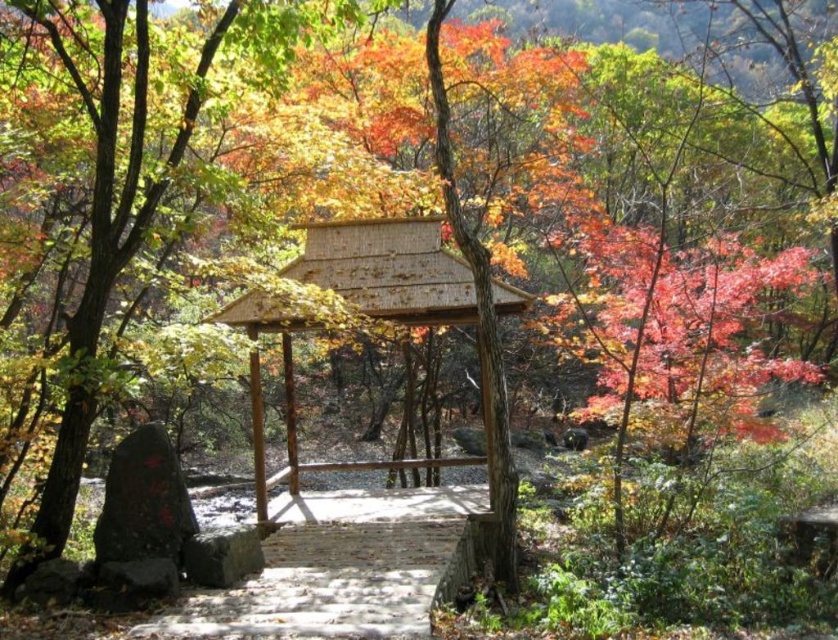
Question: Which of the following is the closest to the observer?

Choices:
 (A) smooth brown wooden gazebo at center
 (B) wooden gazebo at center

Answer: (A)

Question: Which of these objects is positioned farthest from the brown wooden gazebo at center?

Choices:
 (A) smooth brown wooden gazebo at center
 (B) white stone path at center
 (C) wooden gazebo at center

Answer: (A)

Question: Is smooth brown wooden gazebo at center positioned behind wooden gazebo at center?

Choices:
 (A) yes
 (B) no

Answer: (B)

Question: Where is white stone path at center located in relation to wooden gazebo at center in the image?

Choices:
 (A) above
 (B) below

Answer: (B)

Question: Can you confirm if white stone path at center is positioned to the right of brown wooden gazebo at center?

Choices:
 (A) no
 (B) yes

Answer: (B)

Question: Among these points, which one is nearest to the camera?

Choices:
 (A) (425, 312)
 (B) (385, 500)
 (C) (192, 104)
 (D) (396, 321)

Answer: (C)